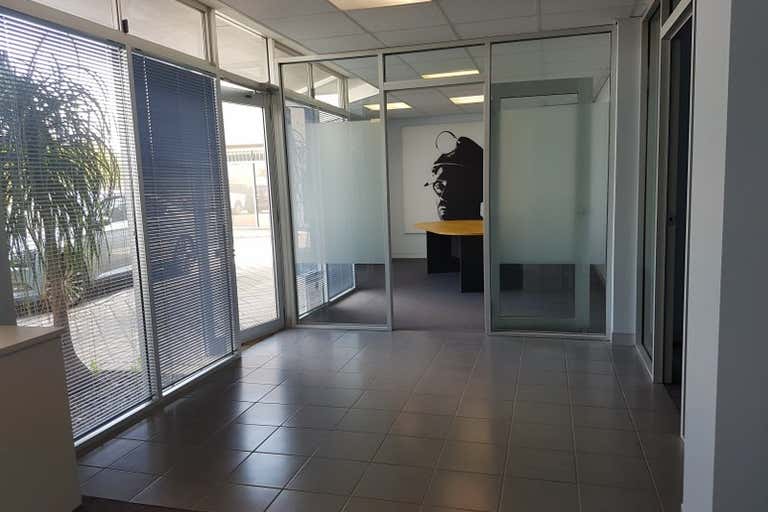
Where is `table in office`? The width and height of the screenshot is (768, 512). table in office is located at coordinates click(465, 231).